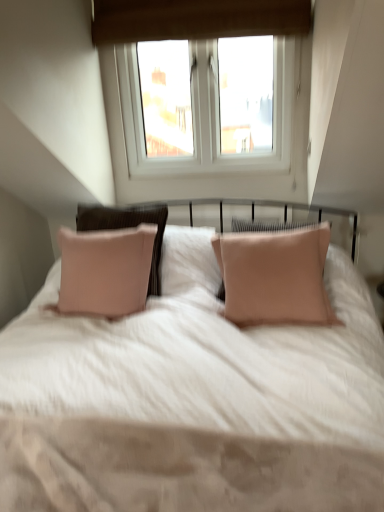
Find the location of a particular element. The width and height of the screenshot is (384, 512). white plastic window at upper center is located at coordinates (196, 19).

Describe the element at coordinates (196, 19) in the screenshot. This screenshot has height=512, width=384. I see `white plastic window at upper center` at that location.

Find the location of `white plastic window at upper center`. white plastic window at upper center is located at coordinates (196, 19).